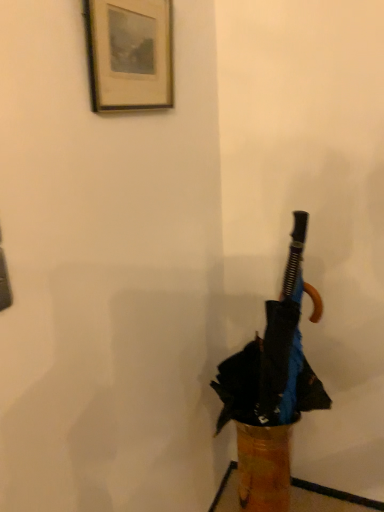
Question: Should I look upward or downward to see black matte umbrella at center?

Choices:
 (A) down
 (B) up

Answer: (A)

Question: Is black matte umbrella at center placed right next to wooden framed print at upper left?

Choices:
 (A) no
 (B) yes

Answer: (A)

Question: From a real-world perspective, is black matte umbrella at center on wooden framed print at upper left?

Choices:
 (A) yes
 (B) no

Answer: (B)

Question: Is black matte umbrella at center far from wooden framed print at upper left?

Choices:
 (A) yes
 (B) no

Answer: (B)

Question: Is black matte umbrella at center thinner than wooden framed print at upper left?

Choices:
 (A) yes
 (B) no

Answer: (B)

Question: Is black matte umbrella at center in front of wooden framed print at upper left?

Choices:
 (A) yes
 (B) no

Answer: (B)

Question: From the image's perspective, would you say black matte umbrella at center is shown under wooden framed print at upper left?

Choices:
 (A) no
 (B) yes

Answer: (B)

Question: Is wooden framed print at upper left not close to black matte umbrella at center?

Choices:
 (A) yes
 (B) no

Answer: (B)

Question: Can you confirm if wooden framed print at upper left is taller than black matte umbrella at center?

Choices:
 (A) yes
 (B) no

Answer: (B)

Question: Considering the relative sizes of wooden framed print at upper left and black matte umbrella at center in the image provided, is wooden framed print at upper left thinner than black matte umbrella at center?

Choices:
 (A) yes
 (B) no

Answer: (A)

Question: Is wooden framed print at upper left wider than black matte umbrella at center?

Choices:
 (A) yes
 (B) no

Answer: (B)

Question: Considering the relative positions of wooden framed print at upper left and black matte umbrella at center in the image provided, is wooden framed print at upper left to the right of black matte umbrella at center from the viewer's perspective?

Choices:
 (A) yes
 (B) no

Answer: (B)

Question: Is wooden framed print at upper left oriented away from black matte umbrella at center?

Choices:
 (A) yes
 (B) no

Answer: (B)

Question: In the image, is wooden framed print at upper left positioned in front of or behind black matte umbrella at center?

Choices:
 (A) front
 (B) behind

Answer: (A)